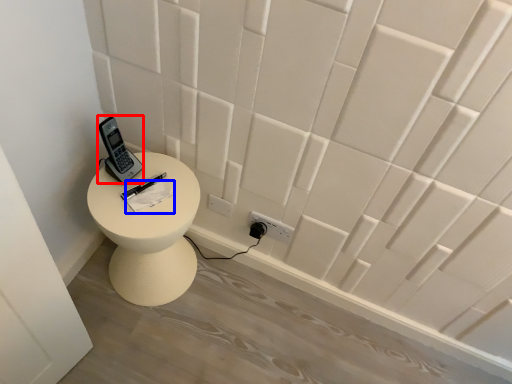
Question: Among these objects, which one is nearest to the camera, control (highlighted by a red box) or notepad (highlighted by a blue box)?

Choices:
 (A) control
 (B) notepad

Answer: (A)